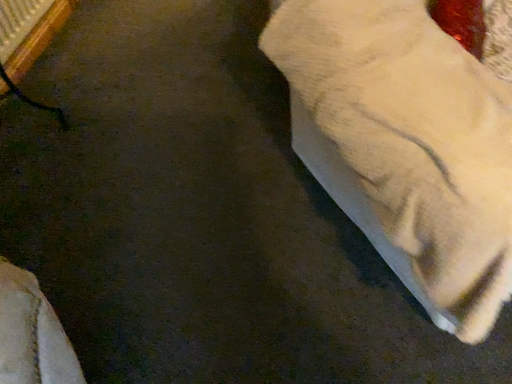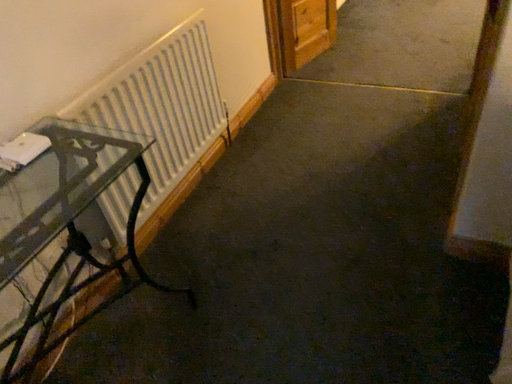
Question: Which way did the camera rotate in the video?

Choices:
 (A) rotated upward
 (B) rotated downward

Answer: (A)